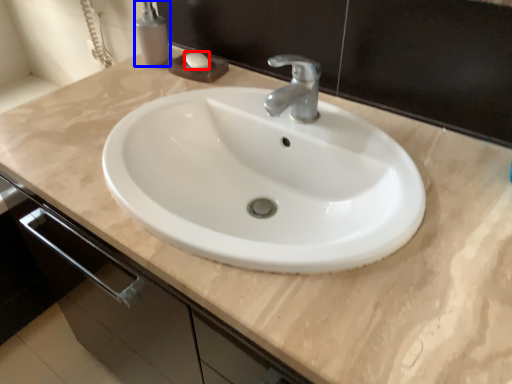
Question: Which object appears closest to the camera in this image, soap (highlighted by a red box) or soap dispenser (highlighted by a blue box)?

Choices:
 (A) soap
 (B) soap dispenser

Answer: (B)